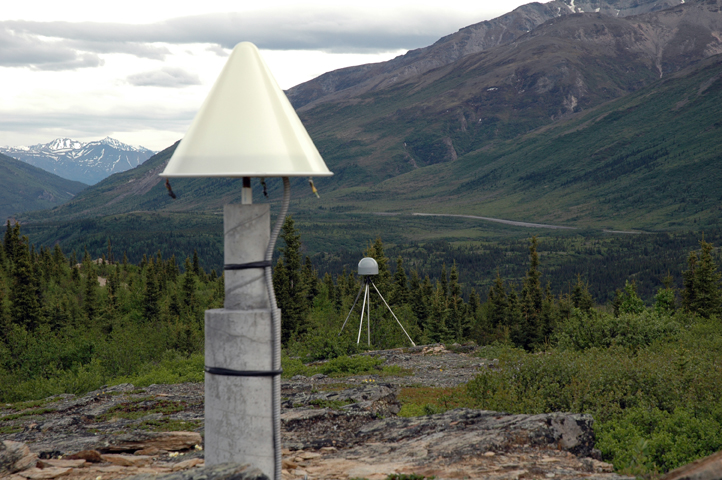
The image size is (722, 480). I want to click on wires, so (313, 193).